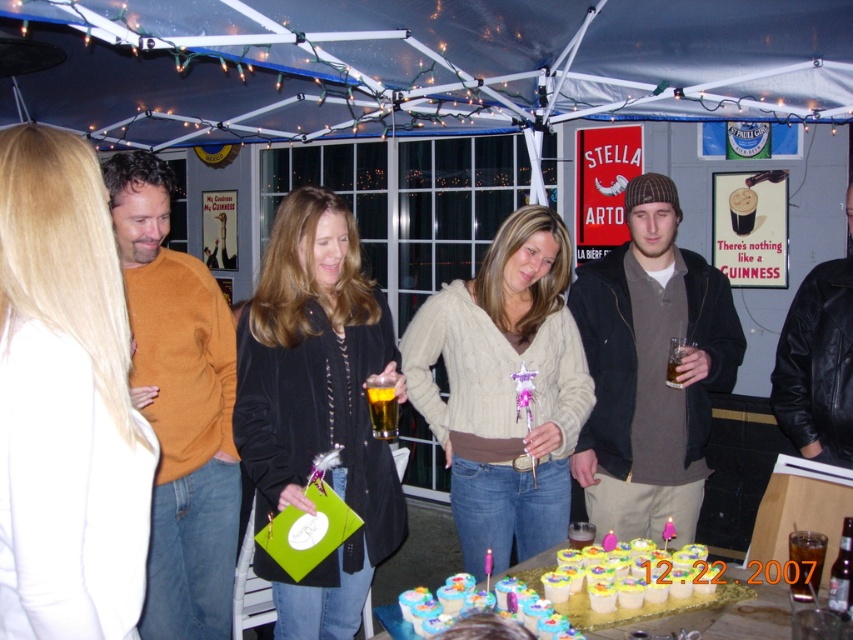
Question: Is blonde hair at left above matte black jacket at center?

Choices:
 (A) no
 (B) yes

Answer: (B)

Question: Which object is the farthest from the white frosted cupcakes at center?

Choices:
 (A) blonde hair at left
 (B) matte black jacket at center
 (C) black leather jacket at center

Answer: (A)

Question: Considering the real-world distances, which object is farthest from the black leather jacket at center?

Choices:
 (A) mustard yellow sweater at left
 (B) cable-knit sweater at center
 (C) translucent glass cup at lower center
 (D) matte black jacket at center

Answer: (A)

Question: Which is nearer to the matte black jacket at center?

Choices:
 (A) dark brown knit hat at center
 (B) mustard yellow sweater at left

Answer: (B)

Question: Is cable-knit sweater at center closer to the viewer compared to white frosted cupcakes at center?

Choices:
 (A) no
 (B) yes

Answer: (A)

Question: Is mustard yellow sweater at left above amber glass beer at center?

Choices:
 (A) no
 (B) yes

Answer: (A)